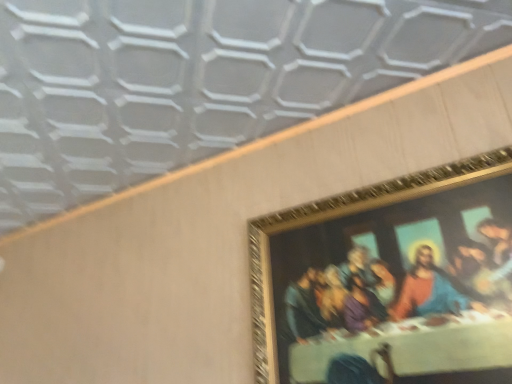
Measure the distance between point (499, 166) and camera.

Point (499, 166) is 3.63 feet away from camera.

Describe the element at coordinates (335, 217) in the screenshot. I see `gold metallic picture frame at upper right` at that location.

Locate an element on the screen. The width and height of the screenshot is (512, 384). gold metallic picture frame at upper right is located at coordinates (335, 217).

Locate an element on the screen. gold metallic picture frame at upper right is located at coordinates (335, 217).